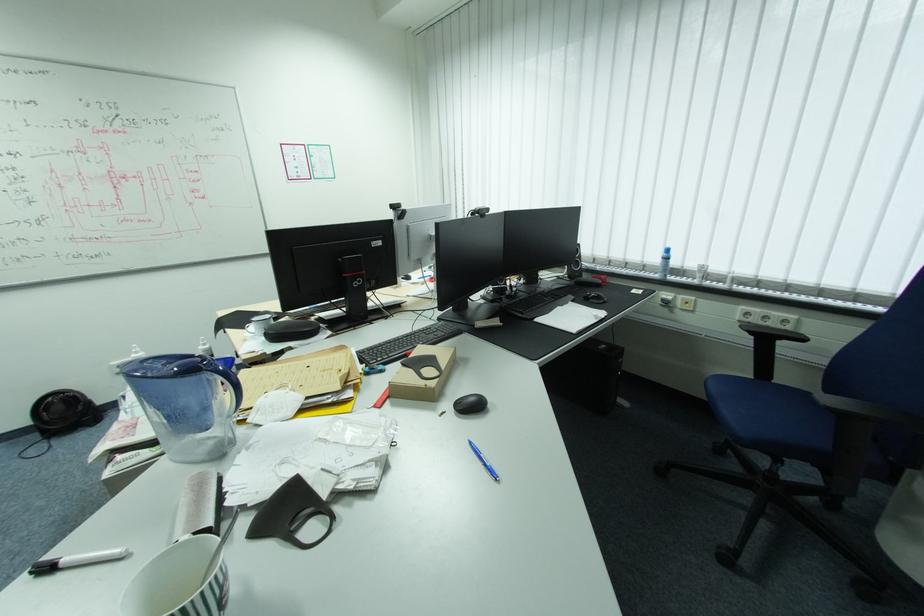
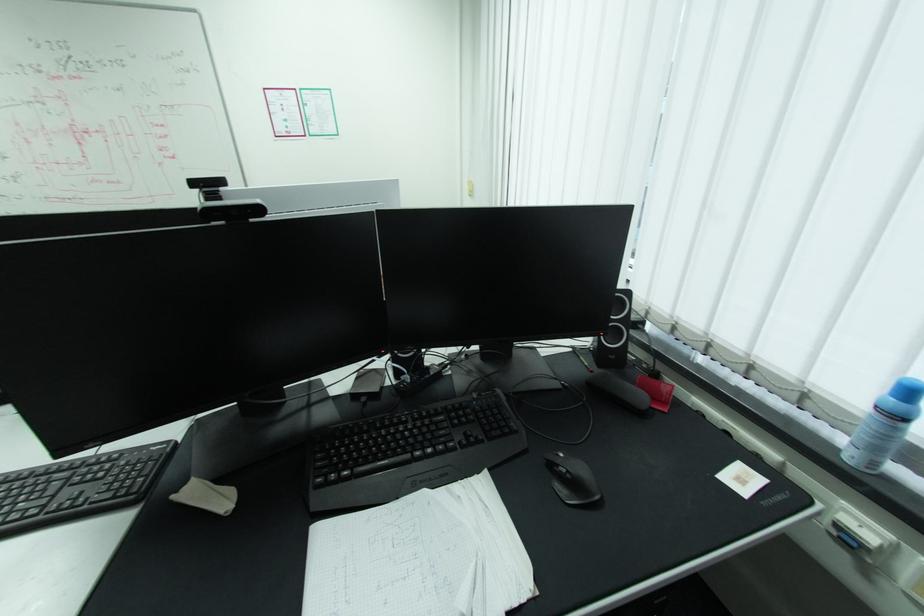
The images are taken continuously from a first-person perspective. In which direction are you moving?

The movement direction of the cameraman is right, forward.